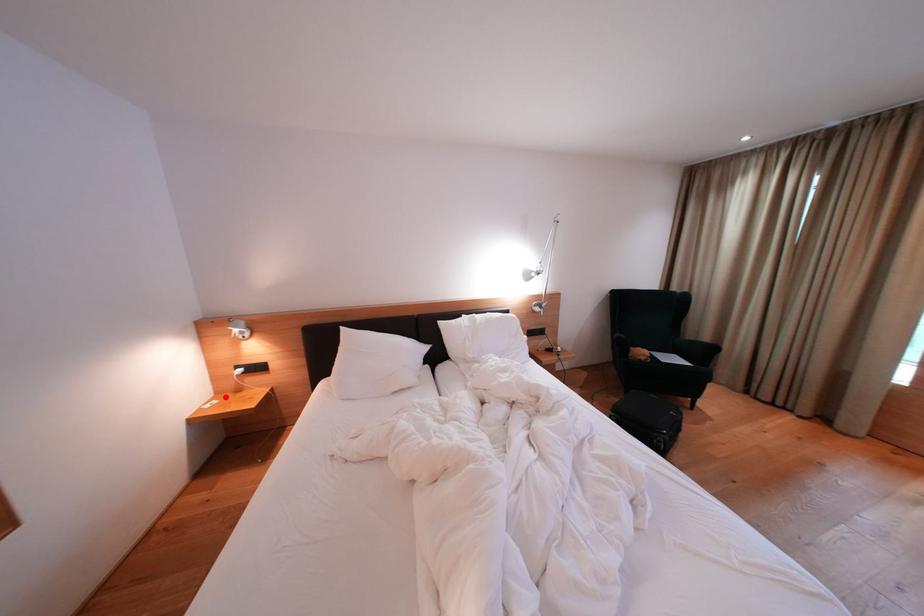
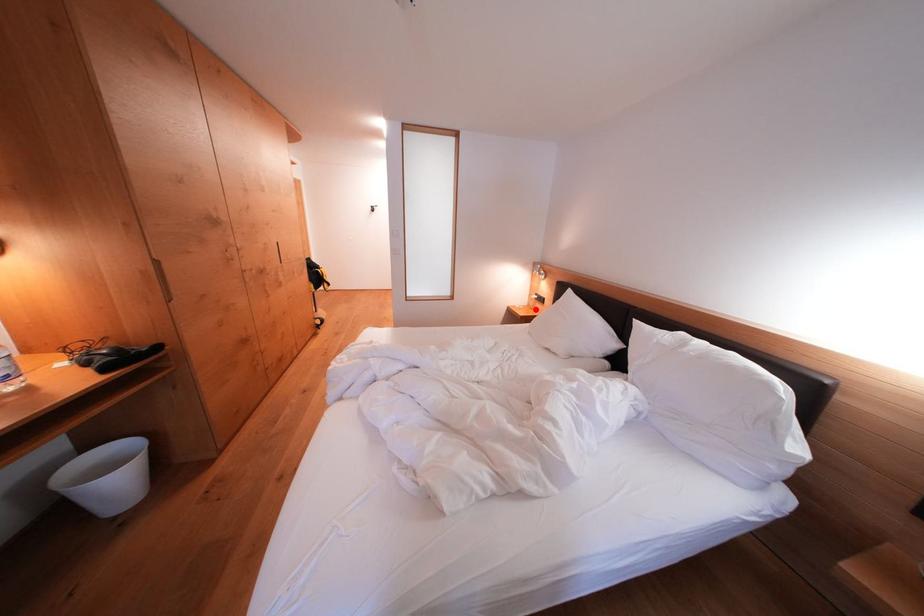
I am providing you with two images of the same scene from different viewpoints. A red point is marked on the first image and another point is marked on the second image. Is the marked point in image1 the same physical position as the marked point in image2?

Yes